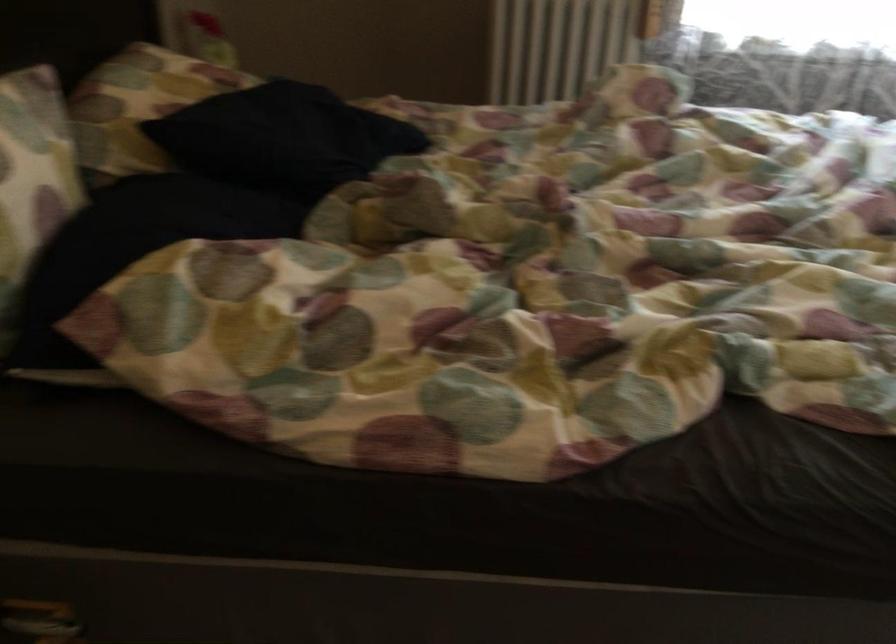
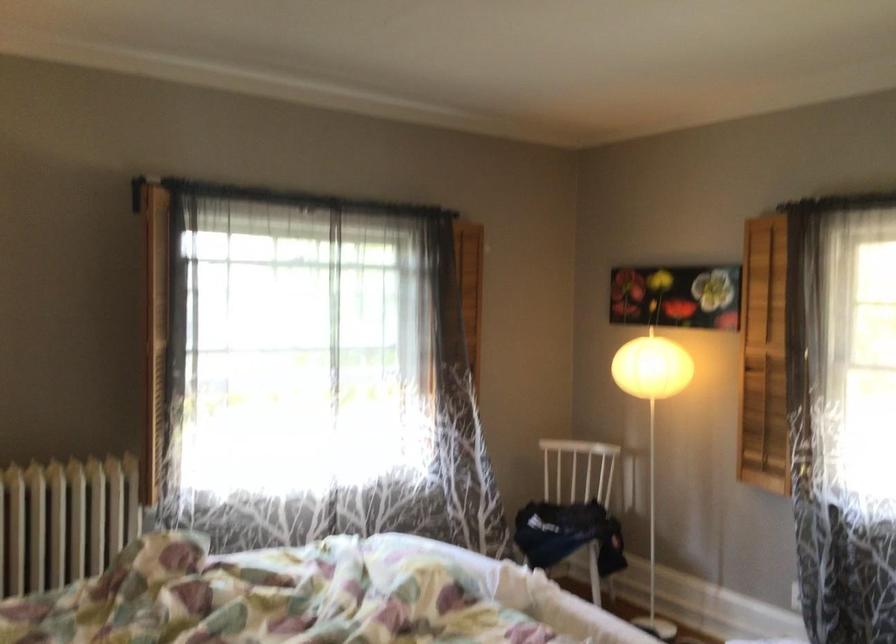
Based on the continuous images, in which direction is the camera rotating?

The camera's rotation is toward right-up.